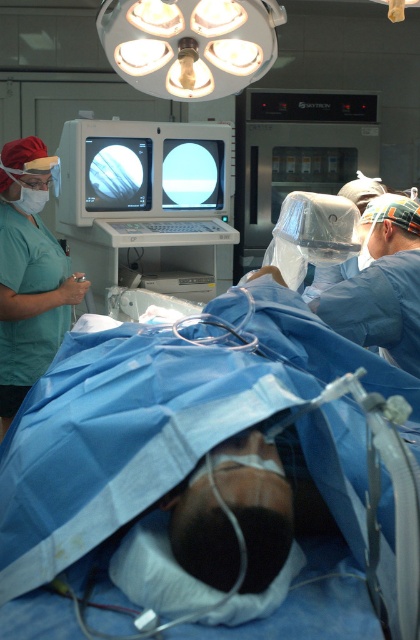
Who is shorter, matte black monitor at upper center or transparent glass monitor at center?

transparent glass monitor at center is shorter.

Identify the location of matte black monitor at upper center. The height and width of the screenshot is (640, 420). (118, 173).

Is point (0, 394) positioned after point (149, 172)?

No.

Which of these two, green scrubs at left or matte black monitor at upper center, stands shorter?

matte black monitor at upper center

What do you see at coordinates (28, 275) in the screenshot? I see `green scrubs at left` at bounding box center [28, 275].

Identify the location of green scrubs at left. This screenshot has height=640, width=420. (28, 275).

Describe the element at coordinates (28, 275) in the screenshot. I see `green scrubs at left` at that location.

Where is `green scrubs at left`? The width and height of the screenshot is (420, 640). green scrubs at left is located at coordinates (28, 275).

In order to click on green scrubs at left in this screenshot , I will do `click(28, 275)`.